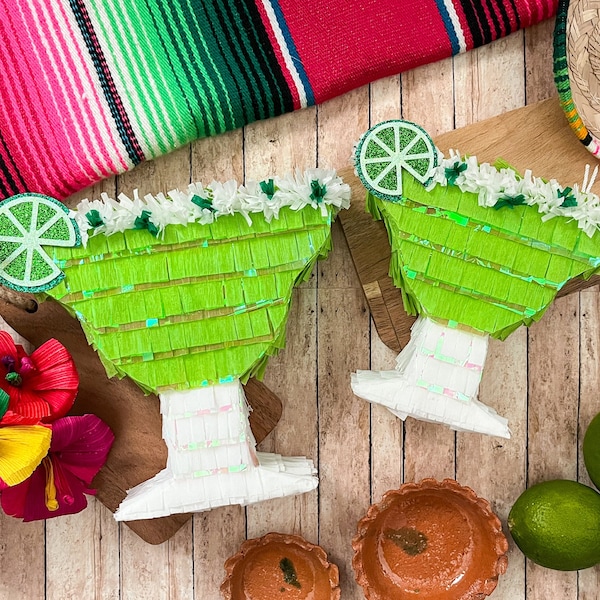
Locate an element on the screen. The image size is (600, 600). clay bowl is located at coordinates (430, 560), (282, 573).